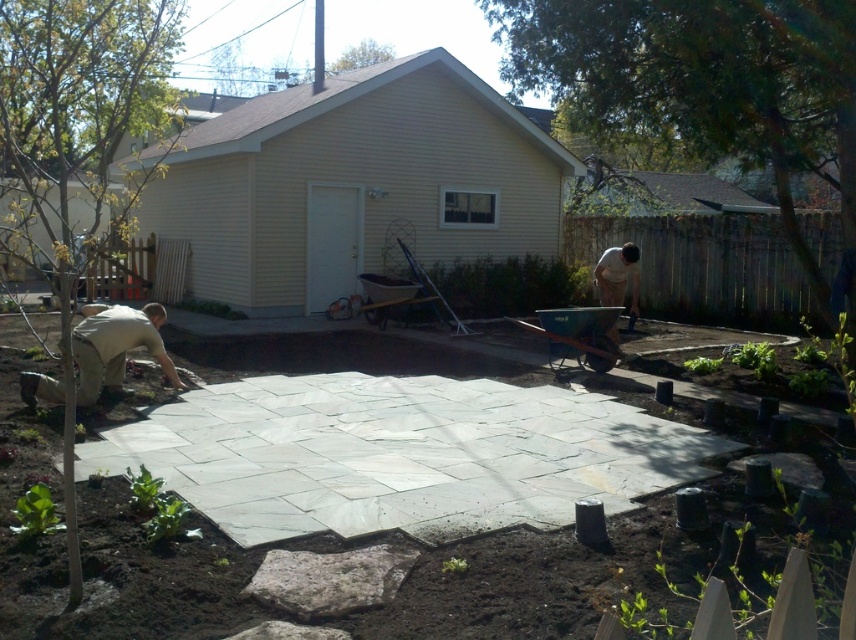
Question: Observing the image, what is the correct spatial positioning of tan/rough fabric man at lower left in reference to light brown wood shovel at right?

Choices:
 (A) right
 (B) left

Answer: (B)

Question: Which object is closer to the camera taking this photo?

Choices:
 (A) light brown wood shovel at right
 (B) tan/rough fabric man at lower left

Answer: (B)

Question: Which point is farther to the camera?

Choices:
 (A) light brown wood shovel at right
 (B) natural stone patio at center

Answer: (A)

Question: Which point is closer to the camera?

Choices:
 (A) (257, 474)
 (B) (96, 385)
 (C) (611, 332)

Answer: (A)

Question: Does natural stone patio at center have a greater width compared to light brown wood shovel at right?

Choices:
 (A) yes
 (B) no

Answer: (A)

Question: Is tan/rough fabric man at lower left thinner than light brown wood shovel at right?

Choices:
 (A) yes
 (B) no

Answer: (B)